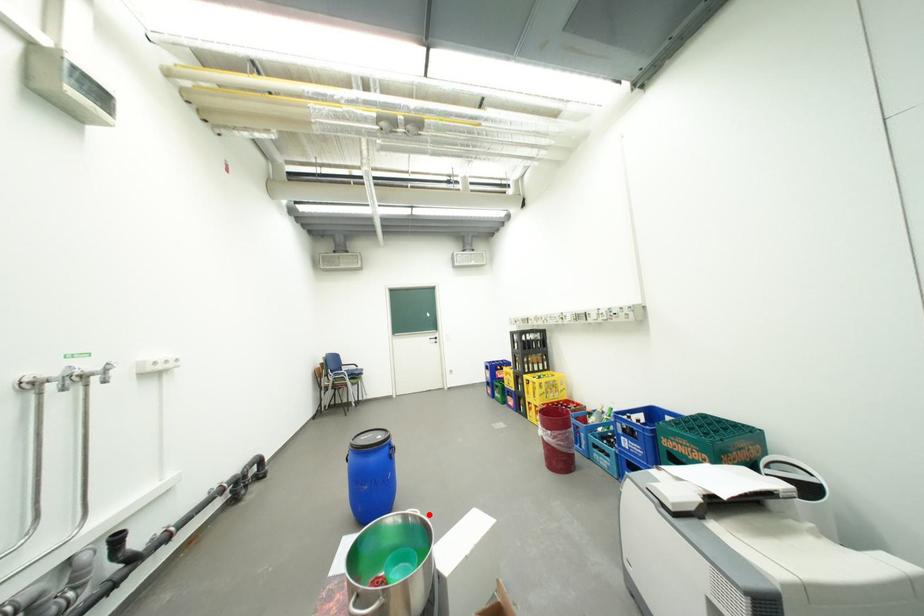
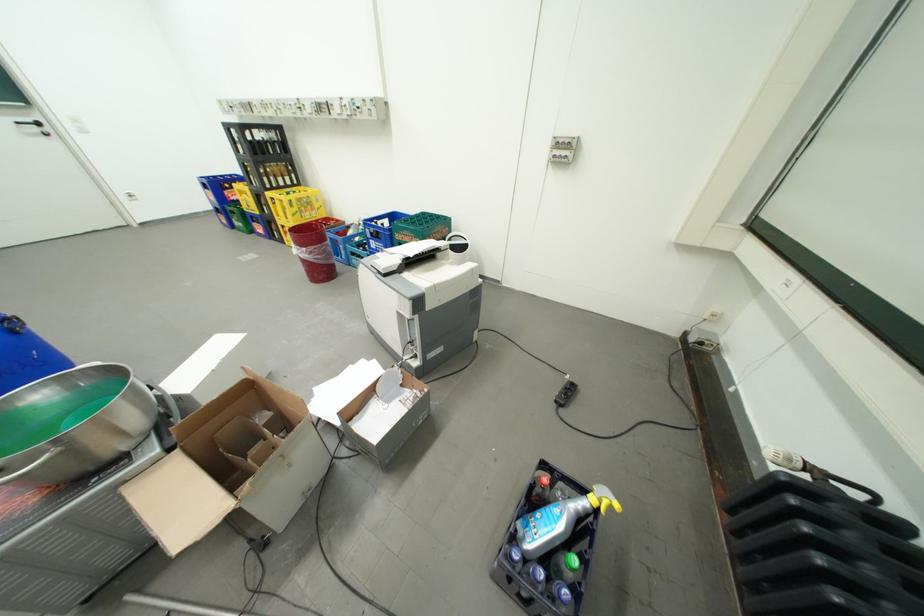
Where in the second image is the point corresponding to the highlighted location from the first image?

(108, 365)